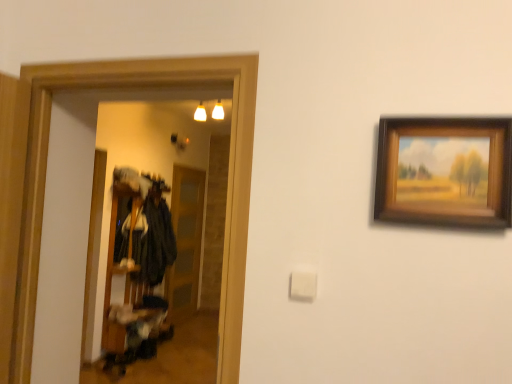
Where is `vacant space in front of transparent glass door at center`? vacant space in front of transparent glass door at center is located at coordinates (189, 335).